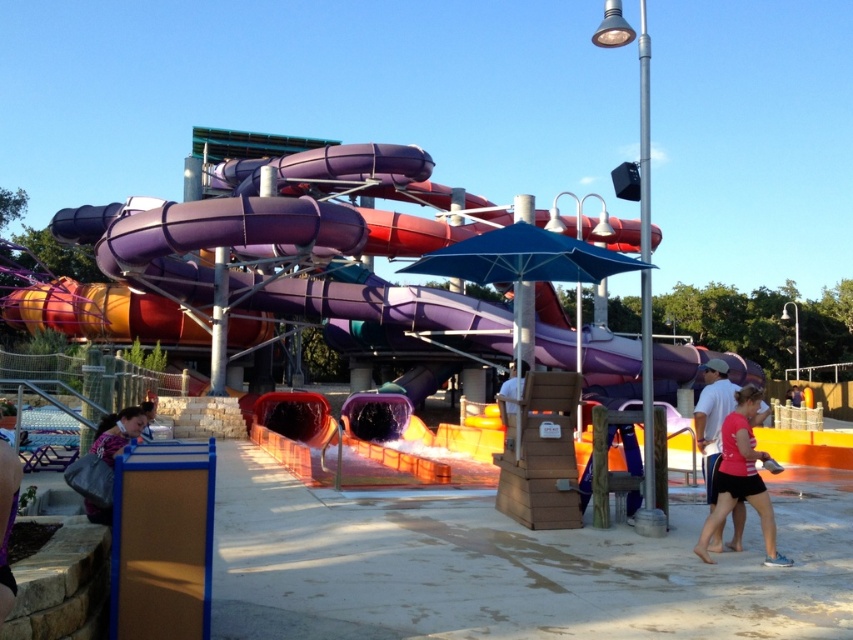
Question: In this image, where is pink fabric shorts at lower right located relative to pink fabric shirt at lower right?

Choices:
 (A) above
 (B) below

Answer: (B)

Question: Estimate the real-world distances between objects in this image. Which object is closer to the pink fabric shorts at lower right?

Choices:
 (A) floral fabric bag at lower left
 (B) pink fabric shirt at lower right

Answer: (B)

Question: Can you confirm if pink fabric shirt at lower right is smaller than floral fabric bag at lower left?

Choices:
 (A) no
 (B) yes

Answer: (B)

Question: Which object appears farthest from the camera in this image?

Choices:
 (A) pink fabric shirt at lower right
 (B) floral fabric bag at lower left
 (C) pink fabric shorts at lower right

Answer: (A)

Question: Which point appears closest to the camera in this image?

Choices:
 (A) (730, 472)
 (B) (132, 417)

Answer: (B)

Question: Does pink fabric shorts at lower right have a smaller size compared to floral fabric bag at lower left?

Choices:
 (A) yes
 (B) no

Answer: (B)